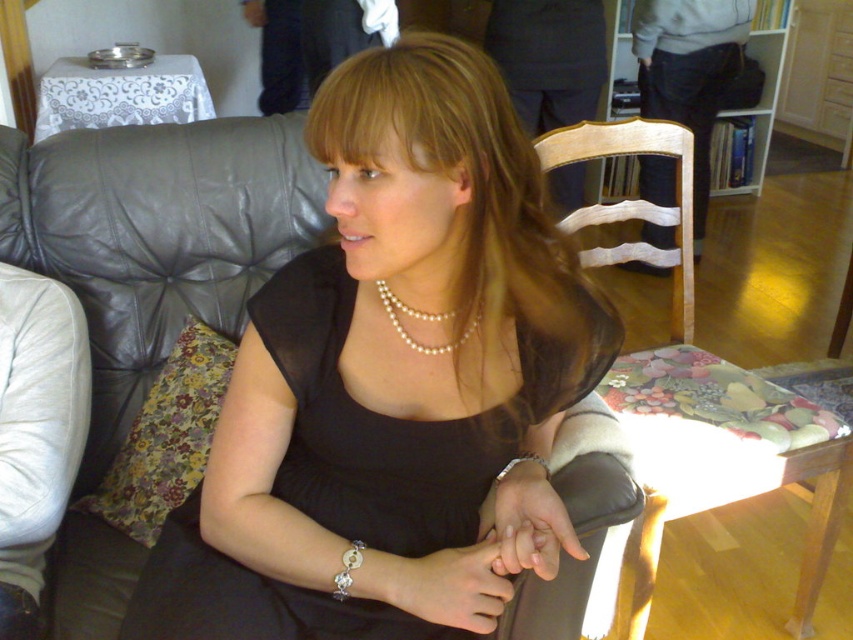
In the scene shown: You are planning to hang a picture frame on the wall in the living room. The frame has a hook that can only be placed at coordinates between 0.0 and 0.5 on the horizontal axis. Is the dark gray suit jacket at upper center within this range?

The dark gray suit jacket at upper center is located at point 0.052 on the horizontal axis, which falls within the range of 0.0 to 0.5. Therefore, the jacket is within the specified horizontal range.

You are an interior designer analyzing the living room layout. You notice a point at coordinate (527, 524). What object is located at this coordinate?

The point at coordinate (527, 524) corresponds to the smooth skin hand at center.

You are a photographer setting up a shoot in the living room. You notice the black sheer dress at center and the smooth skin hand at lower center. Which object is closer to the camera lens? Please explain your reasoning based on their positions.

The black sheer dress at center is in front of the smooth skin hand at lower center, so it is closer to the camera lens.